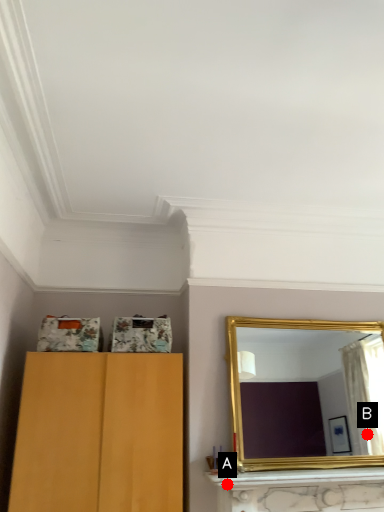
Question: Two points are circled on the image, labeled by A and B beside each circle. Which point is closer to the camera?

Choices:
 (A) A is closer
 (B) B is closer

Answer: (A)